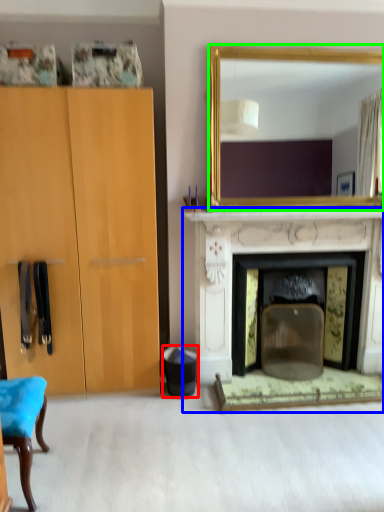
Question: Which is farther away from trash bin/can (highlighted by a red box)? fireplace (highlighted by a blue box) or mirror (highlighted by a green box)?

Choices:
 (A) fireplace
 (B) mirror

Answer: (B)